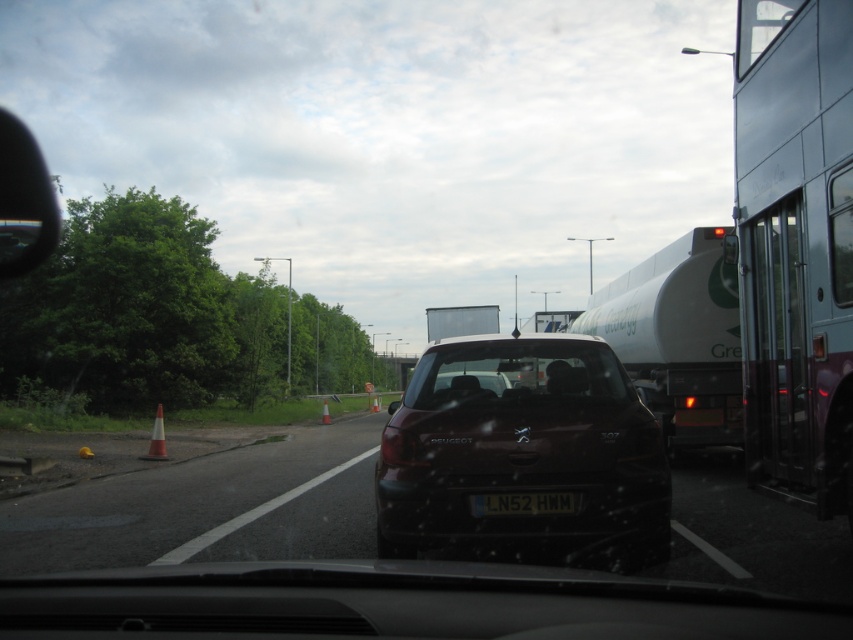
Which is below, white glossy trailer truck at center or transparent glass windshield at center?

transparent glass windshield at center is lower down.

This screenshot has height=640, width=853. Describe the element at coordinates (677, 337) in the screenshot. I see `white glossy trailer truck at center` at that location.

Locate an element on the screen. The width and height of the screenshot is (853, 640). white glossy trailer truck at center is located at coordinates (677, 337).

Does metallic silver bus at right have a greater height compared to transparent glass windshield at center?

Correct, metallic silver bus at right is much taller as transparent glass windshield at center.

Is metallic silver bus at right smaller than transparent glass windshield at center?

Indeed, metallic silver bus at right has a smaller size compared to transparent glass windshield at center.

At what (x,y) coordinates should I click in order to perform the action: click on metallic silver bus at right. Please return your answer as a coordinate pair (x, y). This screenshot has height=640, width=853. Looking at the image, I should click on (795, 243).

Does orange traffic cone at center have a lesser width compared to orange cone at center?

Incorrect, orange traffic cone at center's width is not less than orange cone at center's.

Is orange traffic cone at center bigger than orange cone at center?

Yes, orange traffic cone at center is bigger than orange cone at center.

Does point (323, 404) come in front of point (378, 408)?

Yes, point (323, 404) is closer to viewer.

The width and height of the screenshot is (853, 640). I want to click on orange traffic cone at center, so click(325, 412).